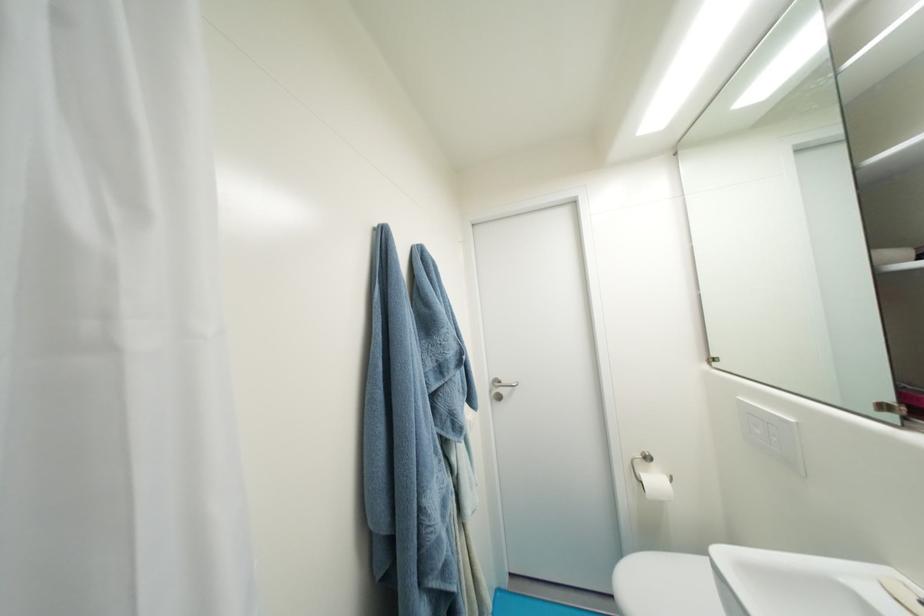
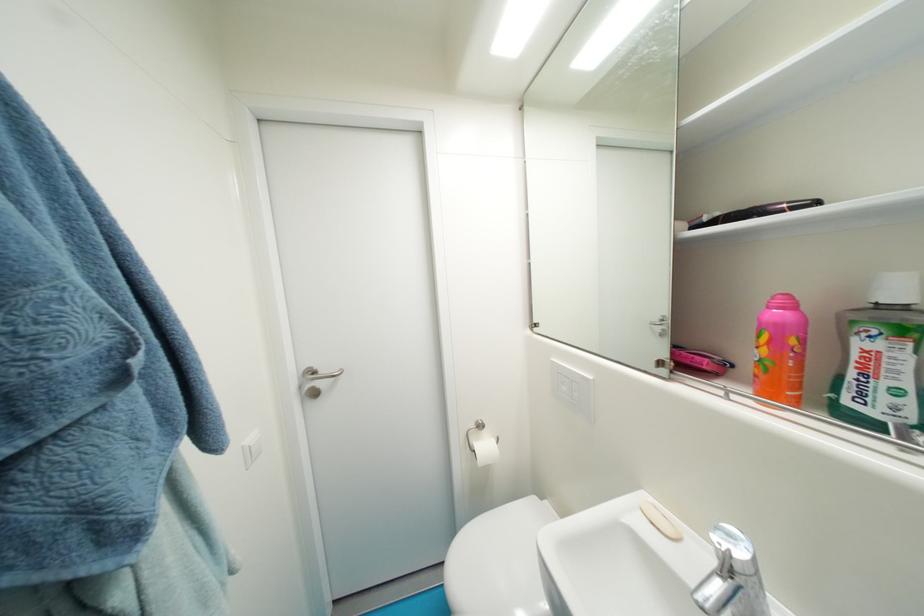
Where in the second image is the point corresponding to (x=764, y=434) from the first image?

(570, 390)